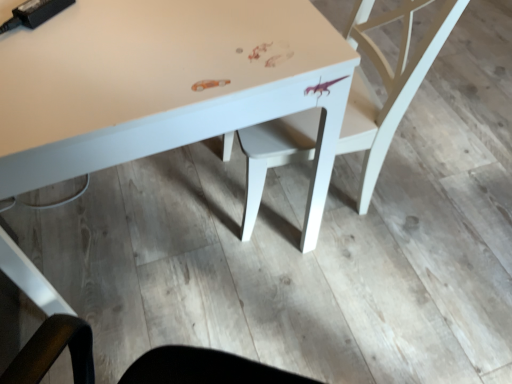
Question: Can you confirm if matte white table at center is thinner than white matte chair at center?

Choices:
 (A) yes
 (B) no

Answer: (B)

Question: Would you say matte white table at center is outside white matte chair at center?

Choices:
 (A) yes
 (B) no

Answer: (A)

Question: From a real-world perspective, is matte white table at center located higher than white matte chair at center?

Choices:
 (A) yes
 (B) no

Answer: (B)

Question: Does matte white table at center have a larger size compared to white matte chair at center?

Choices:
 (A) no
 (B) yes

Answer: (B)

Question: Is white matte chair at center completely or partially inside matte white table at center?

Choices:
 (A) no
 (B) yes

Answer: (B)

Question: Considering the relative sizes of matte white table at center and white matte chair at center in the image provided, is matte white table at center shorter than white matte chair at center?

Choices:
 (A) no
 (B) yes

Answer: (B)

Question: Is white matte chair at center at the right side of matte white table at center?

Choices:
 (A) yes
 (B) no

Answer: (A)

Question: From a real-world perspective, does white matte chair at center sit lower than matte white table at center?

Choices:
 (A) yes
 (B) no

Answer: (B)

Question: Is white matte chair at center shorter than matte white table at center?

Choices:
 (A) yes
 (B) no

Answer: (B)

Question: Does white matte chair at center come in front of matte white table at center?

Choices:
 (A) no
 (B) yes

Answer: (A)

Question: From the image's perspective, is white matte chair at center below matte white table at center?

Choices:
 (A) no
 (B) yes

Answer: (B)

Question: Is white matte chair at center next to matte white table at center?

Choices:
 (A) no
 (B) yes

Answer: (A)

Question: Considering the positions of white matte chair at center and matte white table at center in the image, is white matte chair at center taller or shorter than matte white table at center?

Choices:
 (A) tall
 (B) short

Answer: (A)